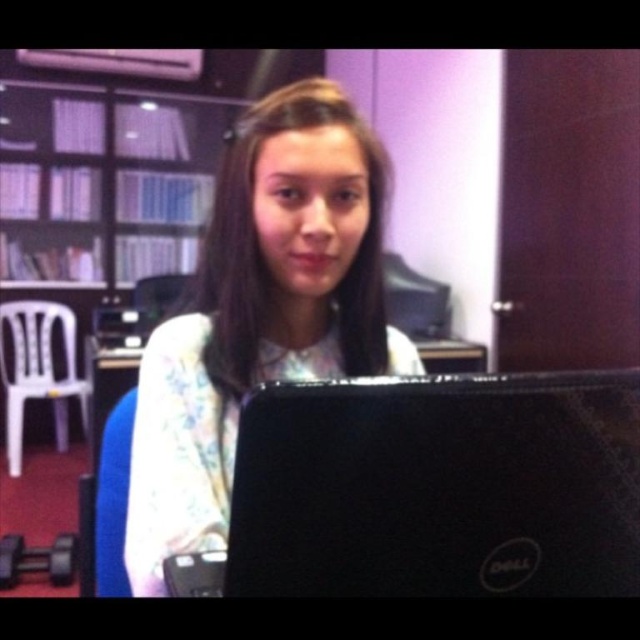
You are organizing a study space and need to move the black matte laptop at center so that it is no longer blocking the view of the matte white bookshelf at upper left. Which direction should you move the laptop?

The black matte laptop at center is currently in front of the matte white bookshelf at upper left. To unblock the view of the matte white bookshelf at upper left, you should move the black matte laptop at center away from the direction of the matte white bookshelf at upper left, likely towards the lower part of the desk.

You are an interior designer assessing the layout of this home office. The white floral shirt at center and the matte white bookshelf at upper left are both visible in the image. Which object is closer to the viewer?

The white floral shirt at center is closer to the viewer because it is in front of the matte white bookshelf at upper left.